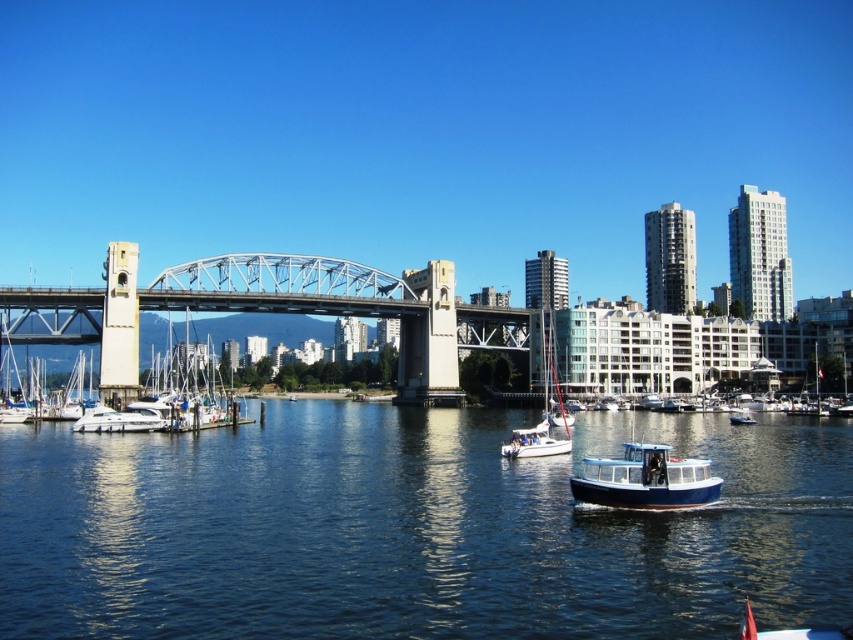
Can you confirm if blue water at center is positioned to the right of white glossy boat at lower left?

Correct, you'll find blue water at center to the right of white glossy boat at lower left.

Between blue water at center and white glossy boat at lower left, which one has less height?

white glossy boat at lower left

Locate an element on the screen. The height and width of the screenshot is (640, 853). blue water at center is located at coordinates (415, 529).

Does blue water at center have a greater height compared to metallic steel bridge at center?

No, blue water at center is not taller than metallic steel bridge at center.

Which of these two, blue water at center or metallic steel bridge at center, stands taller?

metallic steel bridge at center is taller.

Does point (294, 579) come farther from viewer compared to point (119, 288)?

No, it is in front of (119, 288).

Where is `blue water at center`? The width and height of the screenshot is (853, 640). blue water at center is located at coordinates (415, 529).

Who is positioned more to the right, metallic steel bridge at center or blue polished wood boat at center?

Positioned to the right is blue polished wood boat at center.

In the scene shown: Which is above, metallic steel bridge at center or blue polished wood boat at center?

metallic steel bridge at center is above.

Is point (399, 380) behind point (614, 474)?

Yes.

Locate an element on the screen. metallic steel bridge at center is located at coordinates (267, 310).